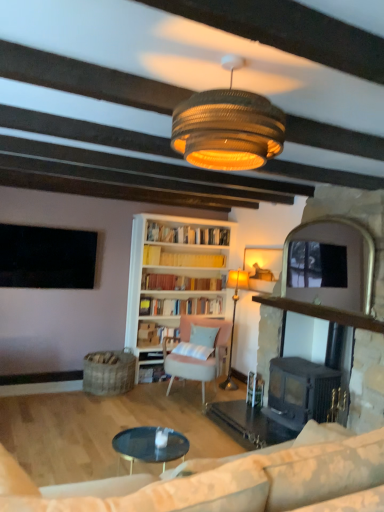
In order to face black matte television at upper left, should I rotate leftwards or rightwards?

Rotate left and turn 18.646 degrees.

What is the approximate height of black matte television at upper left?

It is 28.93 inches.

Locate an element on the screen. This screenshot has height=512, width=384. matte gold lamp at center, placed as the first lamp when sorted from bottom to top is located at coordinates (234, 318).

The image size is (384, 512). Describe the element at coordinates (181, 259) in the screenshot. I see `yellow paperbacks at center, acting as the 1th book starting from the top` at that location.

What is the approximate height of light blue fabric pillow at center?

The height of light blue fabric pillow at center is 38.84 centimeters.

The width and height of the screenshot is (384, 512). I want to click on braided wicker lampshade at center, placed as the first lamp when sorted from top to bottom, so click(x=228, y=127).

Is braided wicker lampshade at center, the second lamp in the back-to-front sequence, located within black cast iron fireplace at center?

Definitely not — braided wicker lampshade at center, the second lamp in the back-to-front sequence, is not inside black cast iron fireplace at center.

Is black cast iron fireplace at center positioned far away from braided wicker lampshade at center, placed as the first lamp when sorted from top to bottom?

Indeed, black cast iron fireplace at center is not near braided wicker lampshade at center, placed as the first lamp when sorted from top to bottom.

Considering the positions of point (338, 310) and point (177, 114), is point (338, 310) closer or farther from the camera than point (177, 114)?

Point (338, 310).

Is black cast iron fireplace at center turned away from braided wicker lampshade at center, which is the second lamp from bottom to top?

black cast iron fireplace at center does not have its back to braided wicker lampshade at center, which is the second lamp from bottom to top.

Is yellow paperbacks at center, marked as the third book in a bottom-to-top arrangement, touching light blue fabric pillow at center?

No, yellow paperbacks at center, marked as the third book in a bottom-to-top arrangement, is not beside light blue fabric pillow at center.

This screenshot has height=512, width=384. What are the coordinates of `pillow lying below the yellow paperbacks at center, acting as the 1th book starting from the top (from the image's perspective)` in the screenshot? It's located at (198, 343).

Between yellow paperbacks at center, acting as the 1th book starting from the top, and light blue fabric pillow at center, which one appears on the right side from the viewer's perspective?

light blue fabric pillow at center is more to the right.

Who is more distant, yellow paperbacks at center, marked as the third book in a bottom-to-top arrangement, or light blue fabric pillow at center?

Positioned behind is yellow paperbacks at center, marked as the third book in a bottom-to-top arrangement.

Which is closer, (x=164, y=339) or (x=150, y=378)?

Point (x=164, y=339).

In the scene shown: Is pastel pink fabric chair at center to the left or to the right of hardcover book at center, which is the first book from bottom to top, in the image?

In the image, pastel pink fabric chair at center appears on the right side of hardcover book at center, which is the first book from bottom to top.

From the image's perspective, which is below, pastel pink fabric chair at center or hardcover book at center, which is the first book from bottom to top?

hardcover book at center, which is the first book from bottom to top.

Considering the relative sizes of hardcover books at center, the second book positioned from the top, and pastel pink fabric chair at center in the image provided, is hardcover books at center, the second book positioned from the top, bigger than pastel pink fabric chair at center?

No.

Could you tell me if hardcover books at center, the second book positioned from the top, is facing pastel pink fabric chair at center?

No, hardcover books at center, the second book positioned from the top, does not turn towards pastel pink fabric chair at center.

Can you confirm if hardcover books at center, acting as the 2th book starting from the bottom, is wider than pastel pink fabric chair at center?

In fact, hardcover books at center, acting as the 2th book starting from the bottom, might be narrower than pastel pink fabric chair at center.

Is hardcover books at center, acting as the 2th book starting from the bottom, surrounding pastel pink fabric chair at center?

No, pastel pink fabric chair at center is not inside hardcover books at center, acting as the 2th book starting from the bottom.

In terms of size, does black cast iron fireplace at center appear bigger or smaller than matte gold lamp at center, which ranks as the 2th lamp in front-to-back order?

In the image, black cast iron fireplace at center appears to be larger than matte gold lamp at center, which ranks as the 2th lamp in front-to-back order.

Considering the sizes of objects black cast iron fireplace at center and matte gold lamp at center, the 2th lamp when ordered from top to bottom, in the image provided, who is thinner, black cast iron fireplace at center or matte gold lamp at center, the 2th lamp when ordered from top to bottom,?

Thinner between the two is matte gold lamp at center, the 2th lamp when ordered from top to bottom.

From a real-world perspective, is black cast iron fireplace at center located higher than matte gold lamp at center, the 2th lamp when ordered from top to bottom?

No.

Would you consider black cast iron fireplace at center to be distant from matte gold lamp at center, which is the first lamp from back to front?

Yes, black cast iron fireplace at center is far from matte gold lamp at center, which is the first lamp from back to front.

Is black cast iron fireplace at center at the left side of pastel pink fabric chair at center?

In fact, black cast iron fireplace at center is to the right of pastel pink fabric chair at center.

Is black cast iron fireplace at center aimed at pastel pink fabric chair at center?

No.

Who is taller, black cast iron fireplace at center or pastel pink fabric chair at center?

Standing taller between the two is black cast iron fireplace at center.

Considering the positions of point (202, 344) and point (168, 376), is point (202, 344) closer or farther from the camera than point (168, 376)?

Point (202, 344) is closer to the camera than point (168, 376).

From a real-world perspective, who is located higher, light blue fabric pillow at center or hardcover book at center, marked as the third book in a top-to-bottom arrangement?

light blue fabric pillow at center.

Considering the sizes of light blue fabric pillow at center and hardcover book at center, which is the first book from bottom to top, in the image, is light blue fabric pillow at center bigger or smaller than hardcover book at center, which is the first book from bottom to top,?

light blue fabric pillow at center is bigger than hardcover book at center, which is the first book from bottom to top.

Measure the distance from light blue fabric pillow at center to hardcover book at center, marked as the third book in a top-to-bottom arrangement.

light blue fabric pillow at center and hardcover book at center, marked as the third book in a top-to-bottom arrangement, are 66.69 centimeters apart from each other.

I want to click on fireplace that is under the braided wicker lampshade at center, acting as the 1th lamp starting from the front (from a real-world perspective), so [x=320, y=313].

This screenshot has width=384, height=512. I want to click on book that is the 1st object to the left of the light blue fabric pillow at center, starting at the anchor, so point(181,259).

From the image, which object appears to be nearer to black cast iron fireplace at center, hardcover book at center, marked as the third book in a top-to-bottom arrangement, or beige fabric couch at lower right?

beige fabric couch at lower right lies closer to black cast iron fireplace at center than the other object.

From the picture: Based on their spatial positions, is pastel pink fabric chair at center or light blue fabric pillow at center closer to matte gold lamp at center, which is the first lamp from back to front?

The object closer to matte gold lamp at center, which is the first lamp from back to front, is light blue fabric pillow at center.

Based on their spatial positions, is beige fabric couch at lower right or matte gold lamp at center, the 2th lamp when ordered from top to bottom, further from light blue fabric pillow at center?

Based on the image, beige fabric couch at lower right appears to be further to light blue fabric pillow at center.

From the image, which object appears to be farther from black cast iron fireplace at center, pastel pink fabric chair at center or beige fabric couch at lower right?

A: beige fabric couch at lower right is positioned further to the anchor black cast iron fireplace at center.

Estimate the real-world distances between objects in this image. Which object is closer to hardcover books at center, the second book positioned from the top, beige fabric couch at lower right or hardcover book at center, which is the first book from bottom to top?

hardcover book at center, which is the first book from bottom to top, lies closer to hardcover books at center, the second book positioned from the top, than the other object.

From the picture: Estimate the real-world distances between objects in this image. Which object is closer to matte gold lamp at center, the 2th lamp when ordered from top to bottom, yellow paperbacks at center, acting as the 1th book starting from the top, or black cast iron fireplace at center?

yellow paperbacks at center, acting as the 1th book starting from the top, lies closer to matte gold lamp at center, the 2th lamp when ordered from top to bottom, than the other object.

Looking at this image, which object lies nearer to the anchor point beige fabric couch at lower right, braided wicker lampshade at center, the second lamp in the back-to-front sequence, or matte gold lamp at center, which is the first lamp from back to front?

braided wicker lampshade at center, the second lamp in the back-to-front sequence, is positioned closer to the anchor beige fabric couch at lower right.

Looking at the image, which one is located further to black matte television at upper left, pastel pink fabric chair at center or light blue fabric pillow at center?

light blue fabric pillow at center is positioned further to the anchor black matte television at upper left.

Where is `book between yellow paperbacks at center, marked as the third book in a bottom-to-top arrangement, and light blue fabric pillow at center vertically`? The image size is (384, 512). book between yellow paperbacks at center, marked as the third book in a bottom-to-top arrangement, and light blue fabric pillow at center vertically is located at coordinates (180, 306).

Locate an element on the screen. This screenshot has height=512, width=384. pillow located between pastel pink fabric chair at center and hardcover books at center, acting as the 2th book starting from the bottom, in the depth direction is located at coordinates (198, 343).

You are a GUI agent. You are given a task and a screenshot of the screen. Output one action in this format:
    pyautogui.click(x=<x>, y=<y>)
    Task: Click on the chair between black cast iron fireplace at center and hardcover books at center, acting as the 2th book starting from the bottom, from front to back
    The width and height of the screenshot is (384, 512).
    Given the screenshot: What is the action you would take?
    pyautogui.click(x=197, y=359)

The width and height of the screenshot is (384, 512). Find the location of `pillow between braided wicker lampshade at center, placed as the first lamp when sorted from top to bottom, and hardcover books at center, the second book positioned from the top, along the z-axis`. pillow between braided wicker lampshade at center, placed as the first lamp when sorted from top to bottom, and hardcover books at center, the second book positioned from the top, along the z-axis is located at coordinates (198, 343).